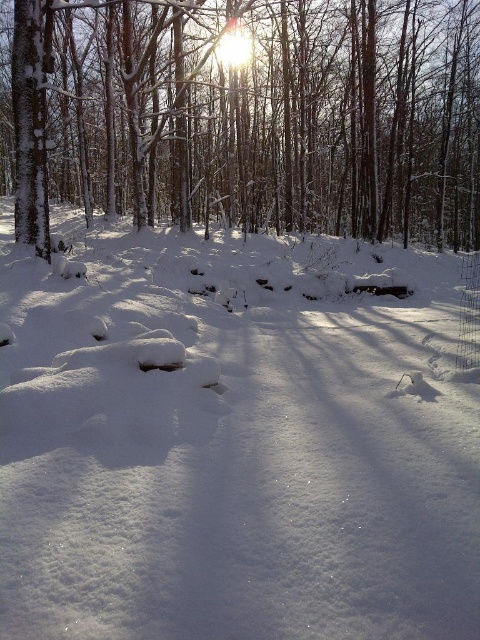
Can you confirm if white fluffy snow at center is taller than snow-covered tree at upper left?

Incorrect, white fluffy snow at center's height is not larger of snow-covered tree at upper left's.

Who is lower down, white fluffy snow at center or snow-covered tree at upper left?

white fluffy snow at center is below.

Locate an element on the screen. This screenshot has height=640, width=480. white fluffy snow at center is located at coordinates (231, 449).